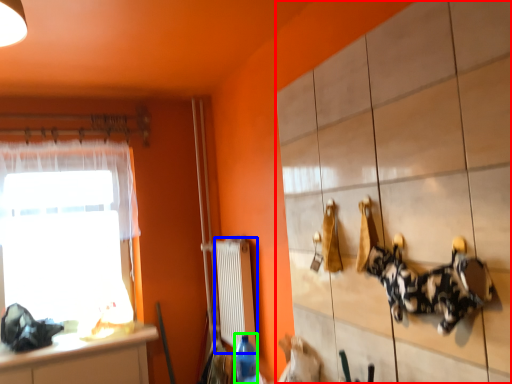
Question: Which object is positioned closest to cabinetry (highlighted by a red box)? Select from radiator (highlighted by a blue box) and bottle (highlighted by a green box).

Choices:
 (A) radiator
 (B) bottle

Answer: (B)